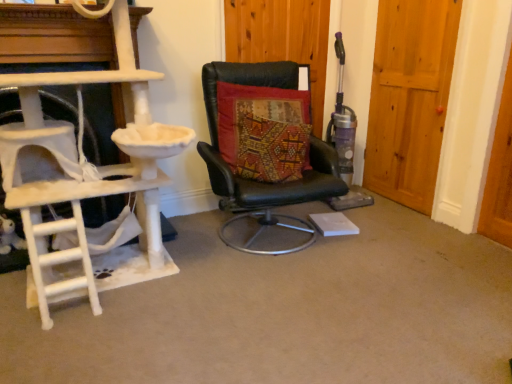
Question: Considering the relative positions of textured multicolored cushion at center and black leather chair at center in the image provided, is textured multicolored cushion at center to the right of black leather chair at center from the viewer's perspective?

Choices:
 (A) no
 (B) yes

Answer: (A)

Question: Is textured multicolored cushion at center closer to the viewer compared to black leather chair at center?

Choices:
 (A) no
 (B) yes

Answer: (A)

Question: From a real-world perspective, is textured multicolored cushion at center physically above black leather chair at center?

Choices:
 (A) yes
 (B) no

Answer: (A)

Question: Is textured multicolored cushion at center further to the viewer compared to black leather chair at center?

Choices:
 (A) no
 (B) yes

Answer: (B)

Question: Is textured multicolored cushion at center thinner than black leather chair at center?

Choices:
 (A) yes
 (B) no

Answer: (A)

Question: From a real-world perspective, is textured multicolored cushion at center positioned above or below wooden door at right, arranged as the 2th door when viewed from the left?

Choices:
 (A) below
 (B) above

Answer: (A)

Question: Based on their positions, is textured multicolored cushion at center located to the left or right of wooden door at right, arranged as the 2th door when viewed from the left?

Choices:
 (A) left
 (B) right

Answer: (A)

Question: Is textured multicolored cushion at center taller or shorter than wooden door at right, which appears as the 1th door when viewed from the right?

Choices:
 (A) short
 (B) tall

Answer: (A)

Question: Is textured multicolored cushion at center spatially inside wooden door at right, which appears as the 1th door when viewed from the right, or outside of it?

Choices:
 (A) outside
 (B) inside

Answer: (A)

Question: Is white carpeted ladder at left in front of or behind wooden door at right, which appears as the 1th door when viewed from the right, in the image?

Choices:
 (A) behind
 (B) front

Answer: (B)

Question: Based on their positions, is white carpeted ladder at left located to the left or right of wooden door at right, which appears as the 1th door when viewed from the right?

Choices:
 (A) right
 (B) left

Answer: (B)

Question: From a real-world perspective, is white carpeted ladder at left physically located above or below wooden door at right, which appears as the 1th door when viewed from the right?

Choices:
 (A) above
 (B) below

Answer: (B)

Question: In terms of size, does white carpeted ladder at left appear bigger or smaller than wooden door at right, which appears as the 1th door when viewed from the right?

Choices:
 (A) small
 (B) big

Answer: (B)

Question: Does point (313, 38) appear closer or farther from the camera than point (252, 109)?

Choices:
 (A) farther
 (B) closer

Answer: (A)

Question: In terms of height, does wooden door at center, the 1th door positioned from the left, look taller or shorter compared to textured multicolored cushion at center?

Choices:
 (A) tall
 (B) short

Answer: (A)